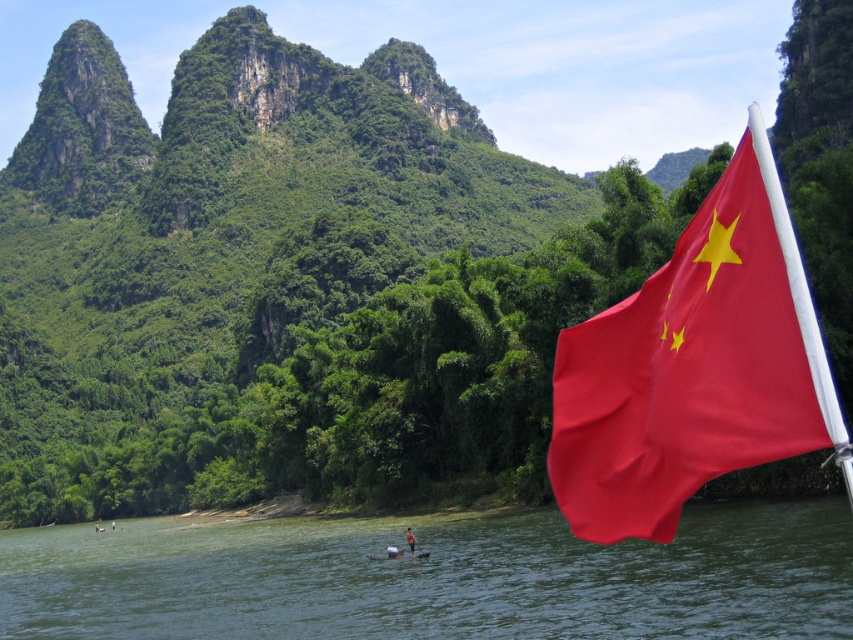
Can you confirm if smooth red flag at right is positioned below smooth skin person at lower center?

No, smooth red flag at right is not below smooth skin person at lower center.

Image resolution: width=853 pixels, height=640 pixels. What do you see at coordinates (695, 365) in the screenshot?
I see `smooth red flag at right` at bounding box center [695, 365].

Between point (575, 408) and point (412, 548), which one is positioned in front?

Point (575, 408)

Identify the location of smooth red flag at right. This screenshot has height=640, width=853. (695, 365).

Between smooth wooden boat at center and smooth skin person at lower center, which one has less height?

smooth wooden boat at center

Between point (386, 556) and point (413, 544), which one is positioned in front?

Positioned in front is point (413, 544).

The height and width of the screenshot is (640, 853). In order to click on smooth wooden boat at center in this screenshot , I will do `click(397, 554)`.

Can you confirm if green water at river right is smaller than smooth wooden boat at center?

Actually, green water at river right might be larger than smooth wooden boat at center.

What do you see at coordinates (434, 577) in the screenshot?
I see `green water at river right` at bounding box center [434, 577].

The height and width of the screenshot is (640, 853). Describe the element at coordinates (434, 577) in the screenshot. I see `green water at river right` at that location.

Where is `green water at river right`? Image resolution: width=853 pixels, height=640 pixels. green water at river right is located at coordinates click(434, 577).